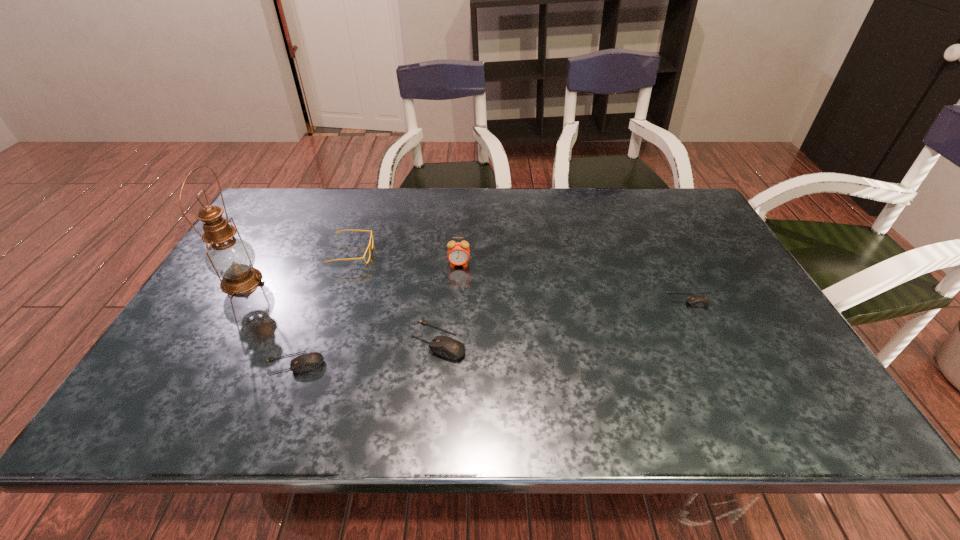
If we want them evenly spaced by inserting an extra mouse_(computer_equipment) among them, please locate a free spot for this new mouse_(computer_equipment). Please provide its 2D coordinates. Your answer should be formatted as a tuple, i.e. [(x, y)], where the tuple contains the x and y coordinates of a point satisfying the conditions above.

[(569, 319)]